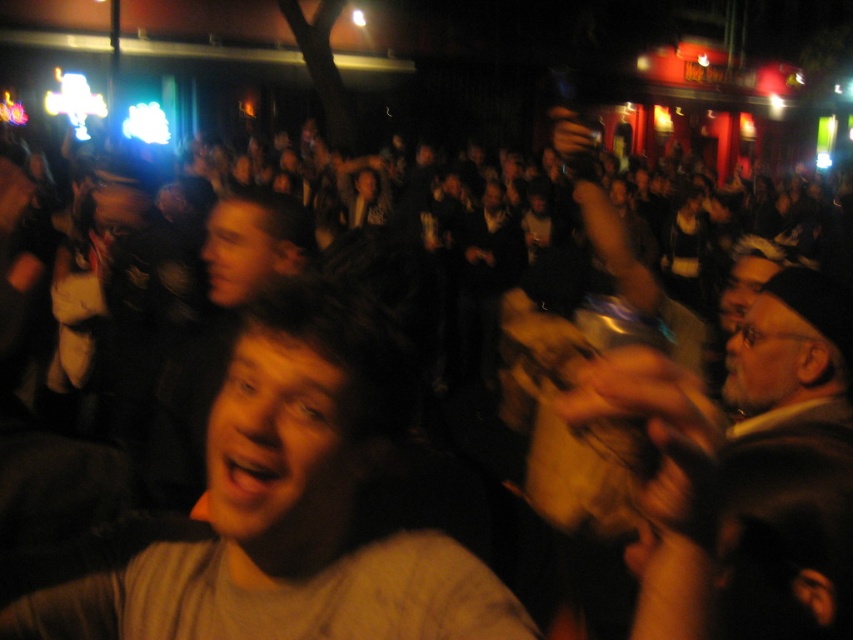
Question: Which point appears farthest from the camera in this image?

Choices:
 (A) (766, 484)
 (B) (161, 541)

Answer: (A)

Question: Does gray cotton shirt at center have a greater width compared to gray wool sweater at center?

Choices:
 (A) no
 (B) yes

Answer: (B)

Question: Can you confirm if gray cotton shirt at center is positioned below gray wool sweater at center?

Choices:
 (A) no
 (B) yes

Answer: (B)

Question: Does gray cotton shirt at center have a larger size compared to gray wool sweater at center?

Choices:
 (A) no
 (B) yes

Answer: (A)

Question: Which of the following is the closest to the observer?

Choices:
 (A) coord(331,557)
 (B) coord(798,300)

Answer: (A)